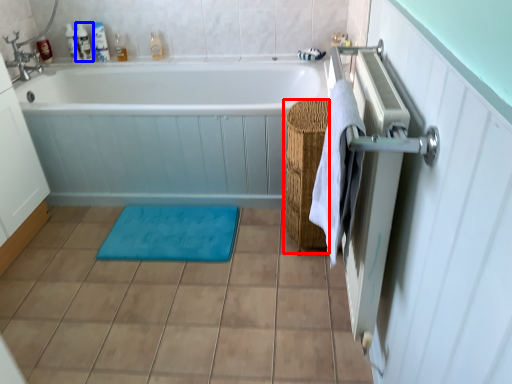
Question: Which object appears closest to the camera in this image, basket (highlighted by a red box) or toiletry (highlighted by a blue box)?

Choices:
 (A) basket
 (B) toiletry

Answer: (A)